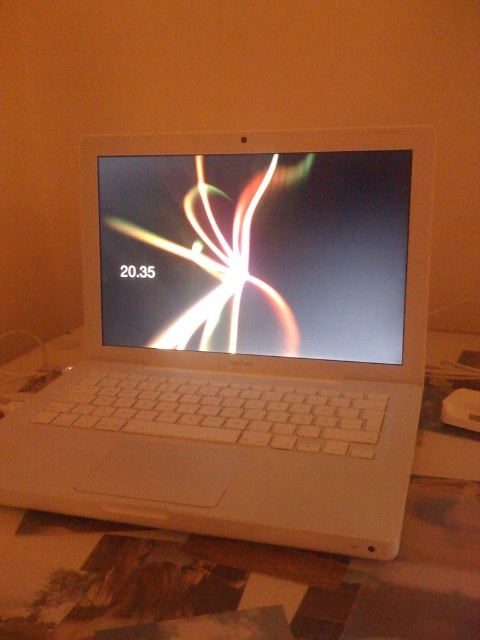
Is white plastic laptop at center positioned behind matte plastic screen at center?

No, white plastic laptop at center is closer to the viewer.

Locate an element on the screen. white plastic laptop at center is located at coordinates (241, 340).

Which is more to the left, matte plastic screen at center or white plastic table at center?

From the viewer's perspective, matte plastic screen at center appears more on the left side.

Between point (343, 337) and point (436, 387), which one is positioned in front?

Positioned in front is point (343, 337).

Locate an element on the screen. The height and width of the screenshot is (640, 480). matte plastic screen at center is located at coordinates (256, 252).

Does white plastic laptop at center appear under white plastic table at center?

No.

Which is behind, point (119, 468) or point (445, 532)?

Point (119, 468)

Between point (403, 198) and point (474, 570), which one is positioned in front?

Point (474, 570)

Locate an element on the screen. The image size is (480, 640). white plastic laptop at center is located at coordinates (241, 340).